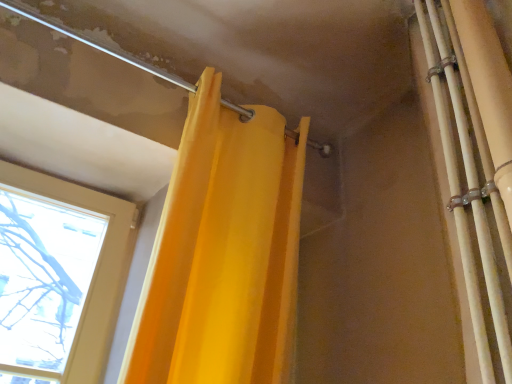
Question: Considering the positions of point (242, 110) and point (487, 96), is point (242, 110) closer or farther from the camera than point (487, 96)?

Choices:
 (A) farther
 (B) closer

Answer: (A)

Question: Looking at the image, does matte metal pipe at upper left seem bigger or smaller compared to matte yellow curtain at upper left?

Choices:
 (A) small
 (B) big

Answer: (A)

Question: Is matte metal pipe at upper left spatially inside matte yellow curtain at upper left, or outside of it?

Choices:
 (A) outside
 (B) inside

Answer: (A)

Question: From a real-world perspective, is matte yellow curtain at upper left above or below matte metal pipe at upper left?

Choices:
 (A) above
 (B) below

Answer: (B)

Question: From the image's perspective, is matte yellow curtain at upper left located above or below matte metal pipe at upper left?

Choices:
 (A) above
 (B) below

Answer: (B)

Question: Is matte yellow curtain at upper left spatially inside matte metal pipe at upper left, or outside of it?

Choices:
 (A) inside
 (B) outside

Answer: (B)

Question: Visually, is matte yellow curtain at upper left positioned to the left or to the right of matte metal pipe at upper left?

Choices:
 (A) left
 (B) right

Answer: (B)